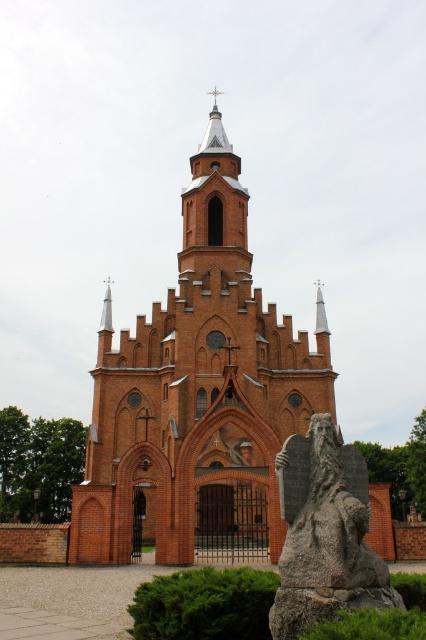
Can you confirm if red brick church tower at center is positioned below gray stone statue at lower right?

Incorrect, red brick church tower at center is not positioned below gray stone statue at lower right.

Which of these two, red brick church tower at center or gray stone statue at lower right, stands taller?

red brick church tower at center

I want to click on red brick church tower at center, so click(x=198, y=394).